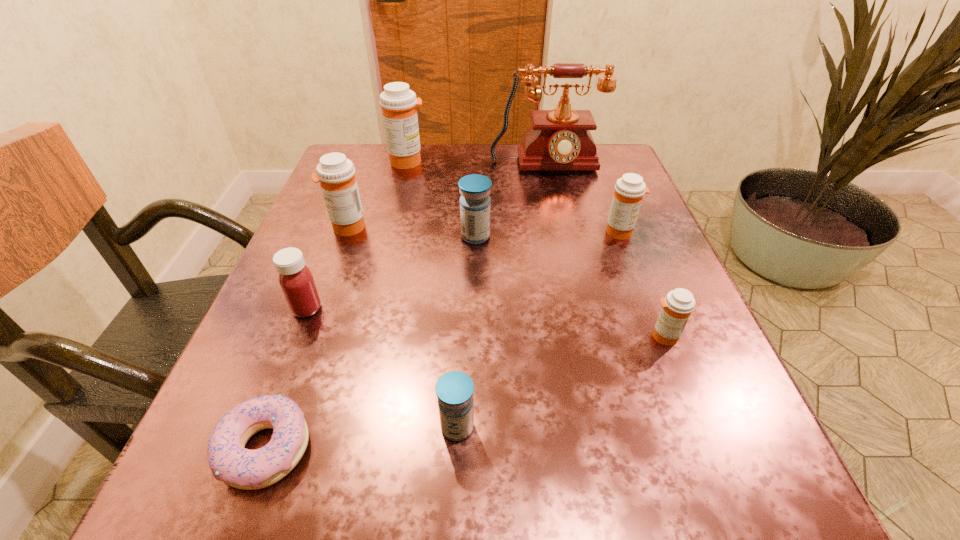
Where is `the tallest object`? the tallest object is located at coordinates (559, 139).

This screenshot has width=960, height=540. What are the coordinates of `the biggest orange medicine` in the screenshot? It's located at (398, 103).

Where is `the farthest orange medicine`? the farthest orange medicine is located at coordinates (398, 103).

At what (x,y) coordinates should I click in order to perform the action: click on the seventh shortest object. Please return your answer as a coordinate pair (x, y). The image size is (960, 540). Looking at the image, I should click on (336, 174).

Identify the location of the second biggest orange medicine. Image resolution: width=960 pixels, height=540 pixels. (336, 174).

In order to click on the farther blue medicine in this screenshot , I will do `click(475, 203)`.

At what (x,y) coordinates should I click in order to perform the action: click on the second smallest orange medicine. Please return your answer as a coordinate pair (x, y). The image size is (960, 540). Looking at the image, I should click on click(x=629, y=190).

This screenshot has width=960, height=540. In order to click on red medicine in this screenshot , I will do `click(296, 281)`.

You are a GUI agent. You are given a task and a screenshot of the screen. Output one action in this format:
    pyautogui.click(x=<x>, y=<y>)
    Task: Click on the sixth farthest object
    
    Given the screenshot: What is the action you would take?
    pyautogui.click(x=296, y=281)

What are the coordinates of `the second nearest medicine` in the screenshot? It's located at (677, 306).